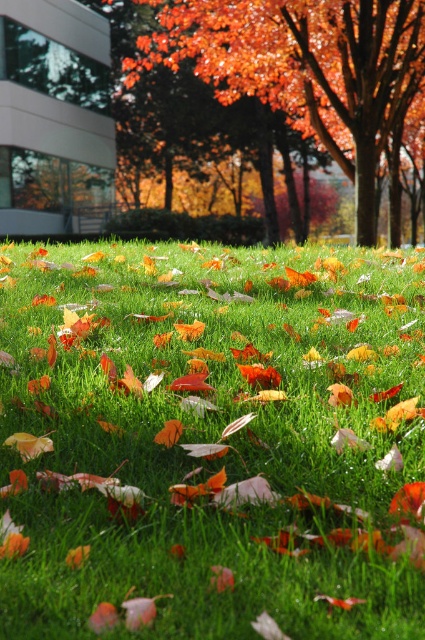
Question: Can you confirm if green grassy at center is bigger than orange matte tree at center?

Choices:
 (A) yes
 (B) no

Answer: (B)

Question: Is green grassy at center below orange matte tree at center?

Choices:
 (A) no
 (B) yes

Answer: (B)

Question: Considering the relative positions of green grassy at center and orange matte tree at center in the image provided, where is green grassy at center located with respect to orange matte tree at center?

Choices:
 (A) left
 (B) right

Answer: (A)

Question: Which point is farther to the camera?

Choices:
 (A) (68, 253)
 (B) (414, 65)

Answer: (B)